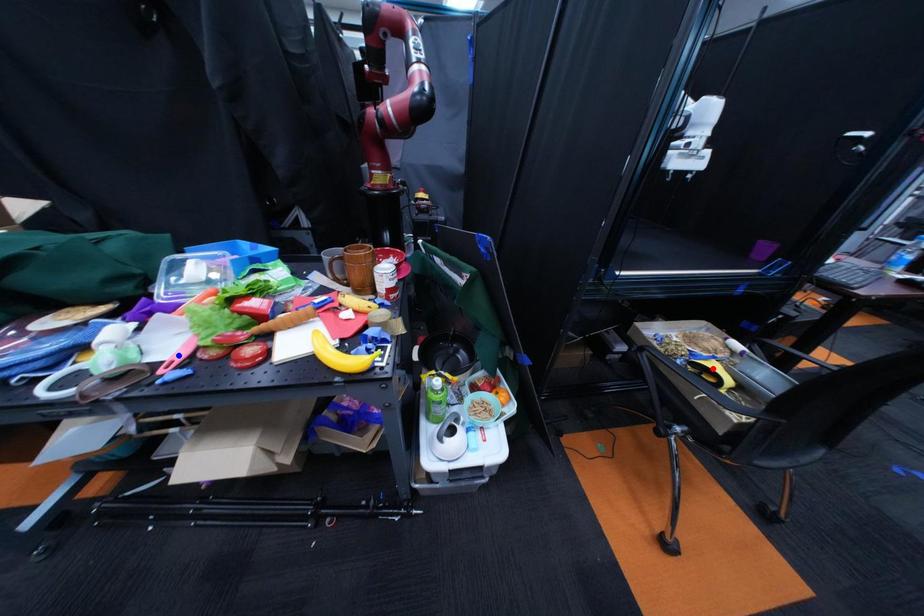
Question: Two points are marked on the image. Which point is closer to the camera?

Choices:
 (A) Blue point is closer.
 (B) Red point is closer.

Answer: (A)